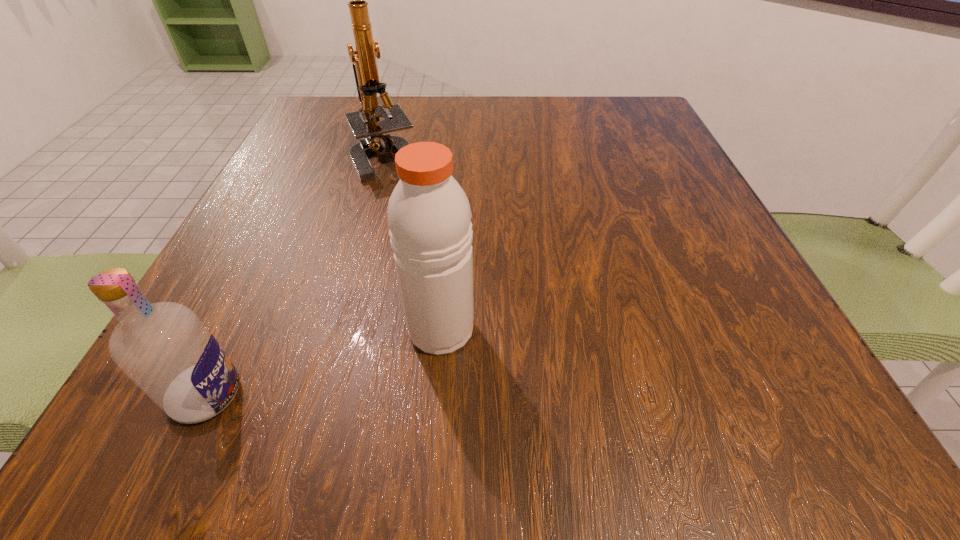
What are the coordinates of `free space that satisfies the following two spatial constraints: 1. at the eyepiece of the second object from left to right; 2. on the right side of the second nearest object` in the screenshot? It's located at (340, 329).

You are a GUI agent. You are given a task and a screenshot of the screen. Output one action in this format:
    pyautogui.click(x=<x>, y=<y>)
    Task: Click on the free space that satisfies the following two spatial constraints: 1. at the eyepiece of the second object from left to right; 2. on the label of the shortest object
    This screenshot has height=540, width=960.
    Given the screenshot: What is the action you would take?
    pyautogui.click(x=323, y=395)

Where is `free space that satisfies the following two spatial constraints: 1. at the eyepiece of the farthest object; 2. on the label of the nearest object`? free space that satisfies the following two spatial constraints: 1. at the eyepiece of the farthest object; 2. on the label of the nearest object is located at coordinates (323, 395).

Find the location of a particular element. vacant space that satisfies the following two spatial constraints: 1. at the eyepiece of the second object from right to left; 2. on the label of the leftmost object is located at coordinates (323, 395).